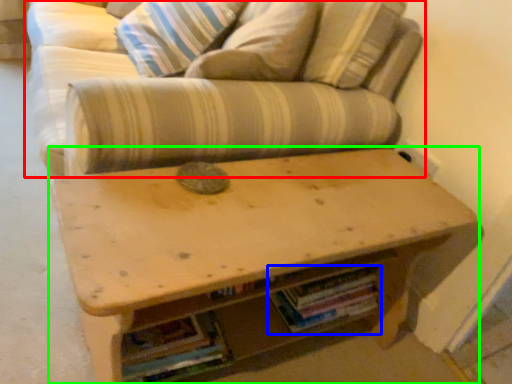
Question: Which object is positioned closest to studio couch (highlighted by a red box)? Select from book (highlighted by a blue box) and table (highlighted by a green box).

Choices:
 (A) book
 (B) table

Answer: (B)